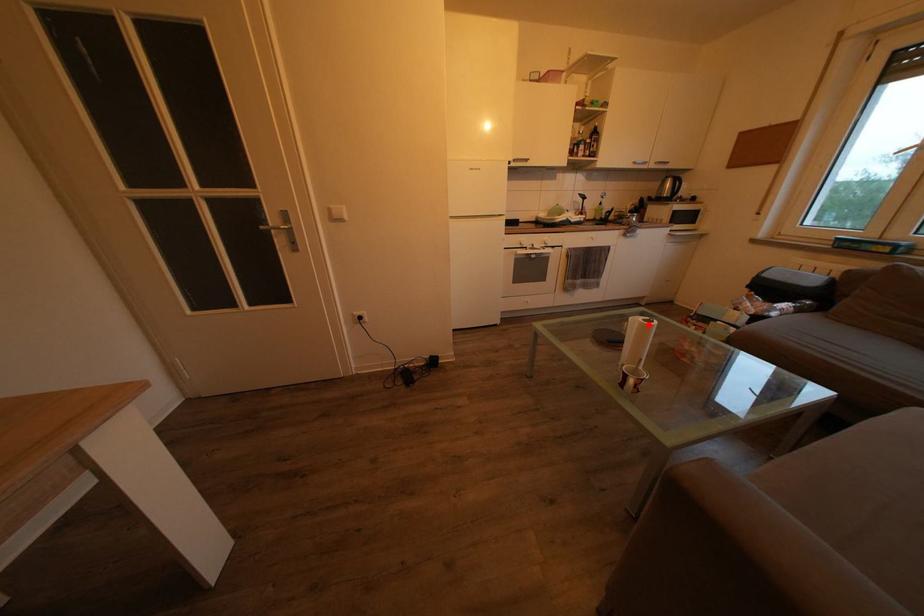
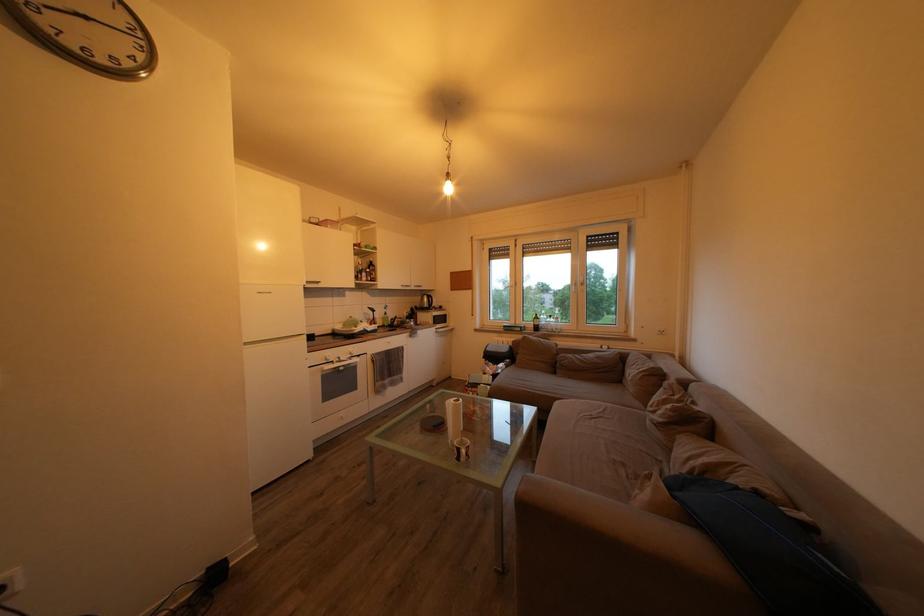
Where in the second image is the point corresponding to the highlighted location from the first image?

(459, 407)